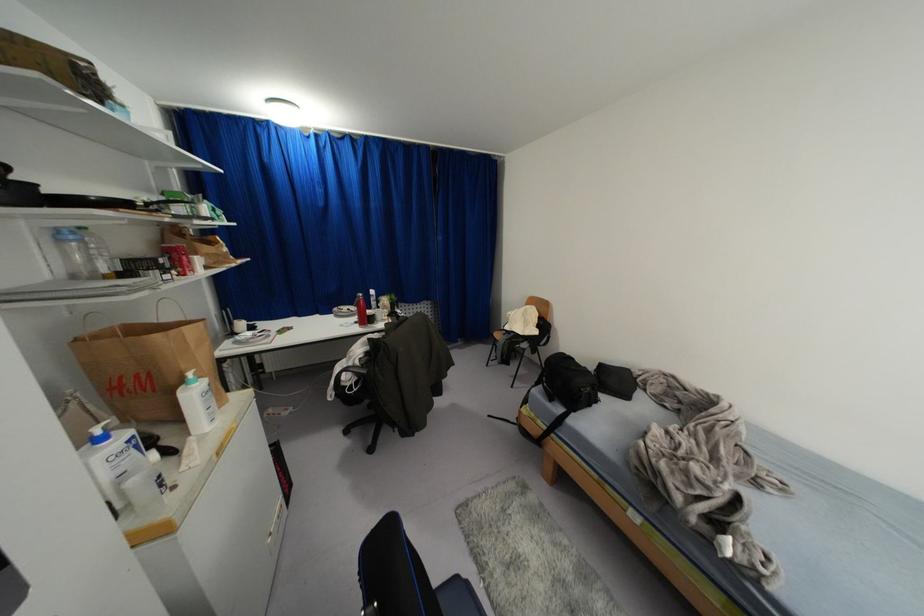
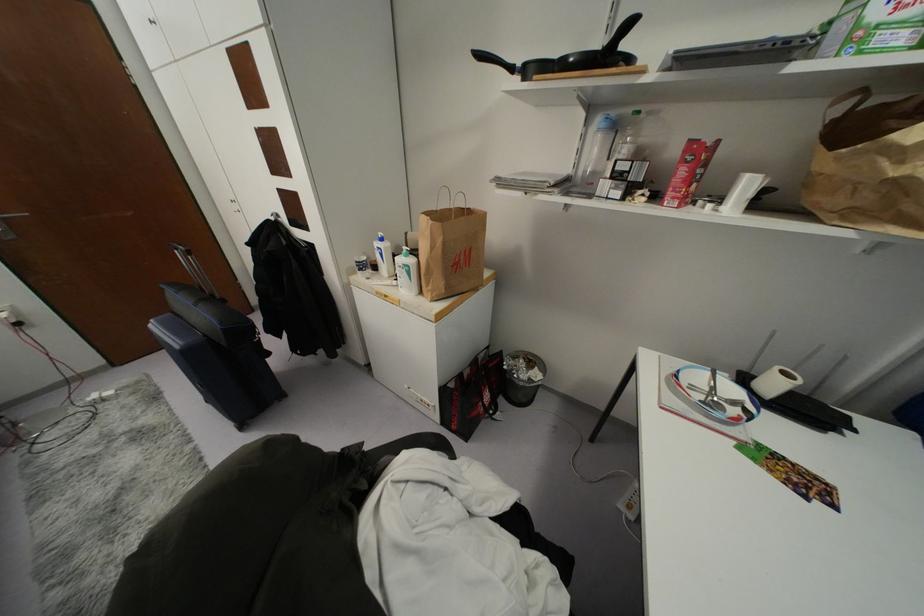
Where in the second image is the point corresponding to point 62,240 from the first image?

(599, 130)